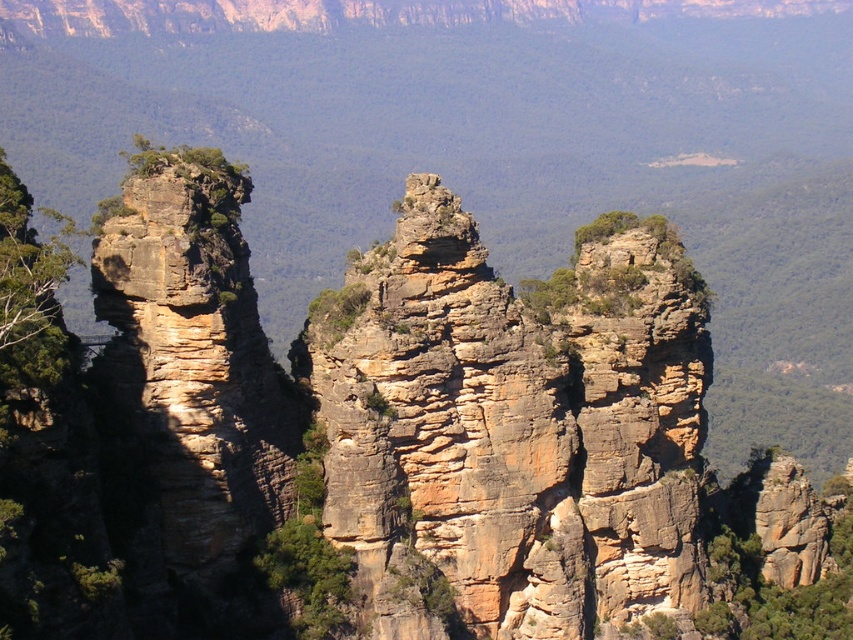
Does rustic stone rock formation at center appear over green rough rock at center?

Correct, rustic stone rock formation at center is located above green rough rock at center.

Can you confirm if rustic stone rock formation at center is wider than green rough rock at center?

Yes, rustic stone rock formation at center is wider than green rough rock at center.

Does point (469, 339) lie in front of point (282, 566)?

No, (469, 339) is behind (282, 566).

The image size is (853, 640). Identify the location of rustic stone rock formation at center. (514, 426).